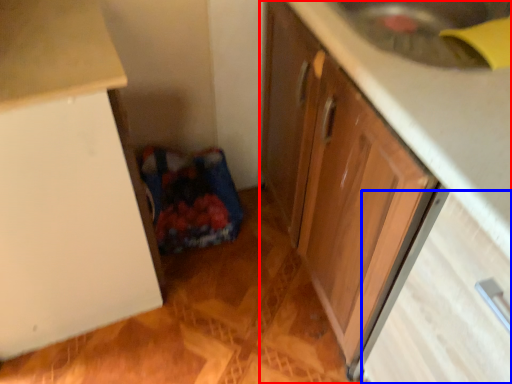
Question: Which of the following is the closest to the observer, cabinetry (highlighted by a red box) or drawer (highlighted by a blue box)?

Choices:
 (A) cabinetry
 (B) drawer

Answer: (A)